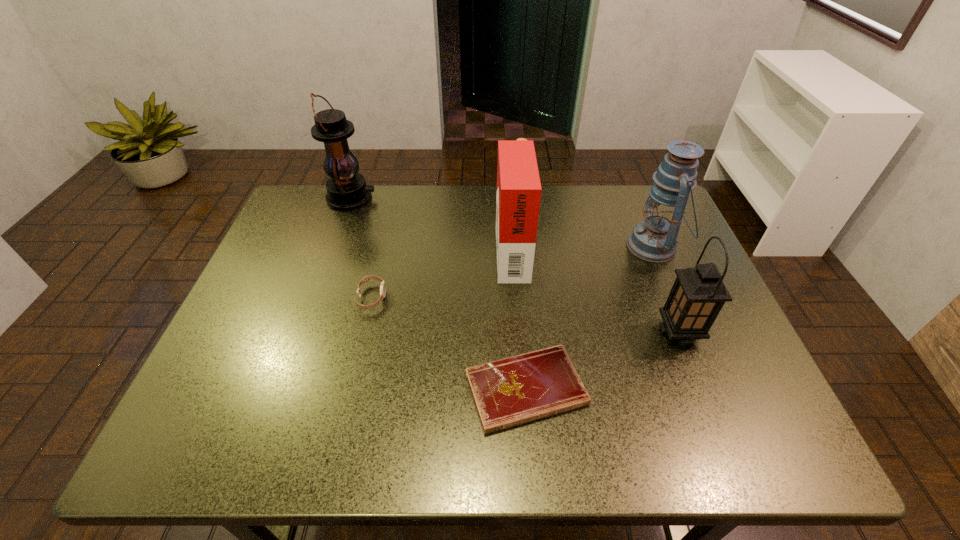
You are a GUI agent. You are given a task and a screenshot of the screen. Output one action in this format:
    pyautogui.click(x=<x>, y=<y>)
    Task: Click on the vacant area in the image that satisfies the following two spatial constraints: 1. on the front-facing side of the cigarette case; 2. on the back side of the nearest lantern
    
    Given the screenshot: What is the action you would take?
    pyautogui.click(x=518, y=332)

The image size is (960, 540). Find the location of `vacant region that satisfies the following two spatial constraints: 1. on the front-facing side of the cigarette case; 2. on the back side of the second nearest object`. vacant region that satisfies the following two spatial constraints: 1. on the front-facing side of the cigarette case; 2. on the back side of the second nearest object is located at coordinates (518, 332).

At what (x,y) coordinates should I click in order to perform the action: click on free space that satisfies the following two spatial constraints: 1. above the second nearest object, indicating its light source; 2. on the left side of the leftmost object. Please return your answer as a coordinate pair (x, y). The image size is (960, 540). Looking at the image, I should click on (303, 332).

Locate an element on the screen. The height and width of the screenshot is (540, 960). vacant area that satisfies the following two spatial constraints: 1. on the face of the shortest object; 2. on the right side of the second shortest object is located at coordinates click(x=350, y=390).

You are a GUI agent. You are given a task and a screenshot of the screen. Output one action in this format:
    pyautogui.click(x=<x>, y=<y>)
    Task: Click on the free location that satisfies the following two spatial constraints: 1. on the front-facing side of the second nearest lantern; 2. on the front side of the notebook
    This screenshot has width=960, height=540.
    Given the screenshot: What is the action you would take?
    pyautogui.click(x=715, y=390)

The height and width of the screenshot is (540, 960). Find the location of `vacant space that satisfies the following two spatial constraints: 1. on the back side of the shortest object; 2. on the face of the second object from left to right`. vacant space that satisfies the following two spatial constraints: 1. on the back side of the shortest object; 2. on the face of the second object from left to right is located at coordinates (518, 298).

This screenshot has width=960, height=540. I want to click on vacant area in the image that satisfies the following two spatial constraints: 1. on the back side of the nearest lantern; 2. above the farthest lantern, indicating its light source, so click(626, 198).

The image size is (960, 540). In order to click on vacant region that satisfies the following two spatial constraints: 1. above the notebook, indicating its light source; 2. on the right side of the leftmost lantern in this screenshot , I will do `click(283, 390)`.

The image size is (960, 540). In order to click on free spot that satisfies the following two spatial constraints: 1. on the face of the nearest lantern; 2. on the right side of the fifth tallest object in this screenshot , I will do `click(364, 332)`.